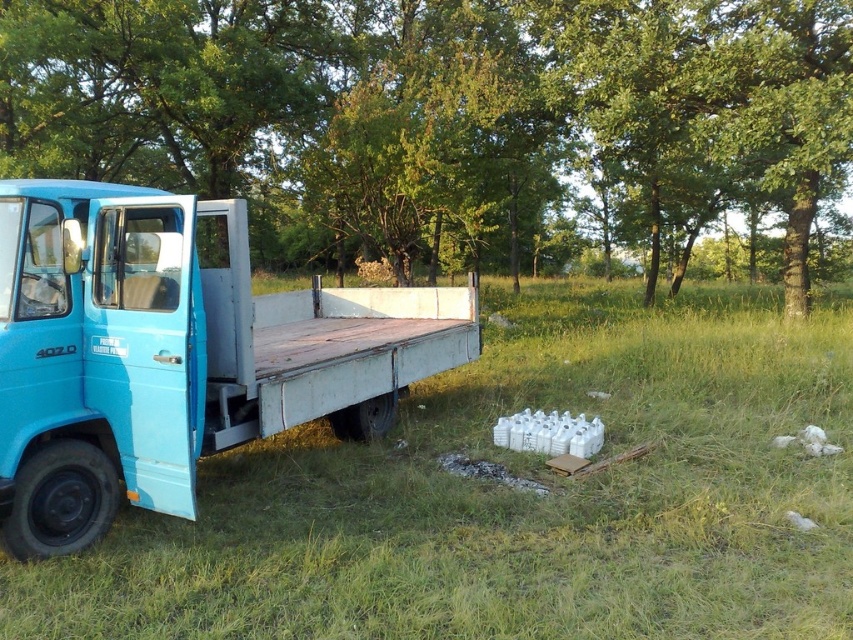
In the scene shown: You are a delivery driver who needs to back up your blue matte truck at left into a loading bay. There is a green leafy tree at upper center in your way. Can you safely back up without hitting the tree?

The green leafy tree at upper center is positioned over the blue matte truck at left, so you can safely back up the blue matte truck at left without hitting the tree since the tree is above it and not in the path.

You are a photographer trying to capture a wide shot of the blue flatbed truck parked on the grassy area. You want to include both the green leafy tree at upper center and the green grassy at lower left in your frame. Based on their sizes, which object will occupy more space in your photo?

The green leafy tree at upper center will occupy more space in the photo because its width is larger than that of the green grassy at lower left.